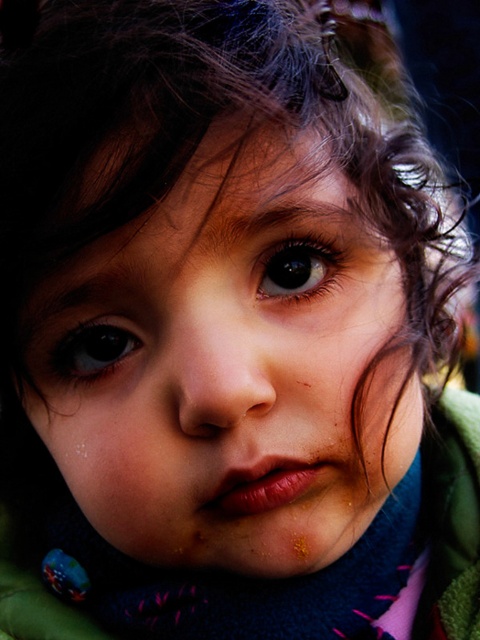
You are a photographer adjusting your camera settings to capture a close portrait of a child with dark curly hair. You need to ensure the focus is sharp on the child. Given that the camera is focused at a point 12.35 inches away, will the child be in focus if the point you selected is at point [264,540]?

Yes, the child will be in focus because the distance between the camera and point [264,540] is exactly 12.35 inches, which is the focus point of the camera.